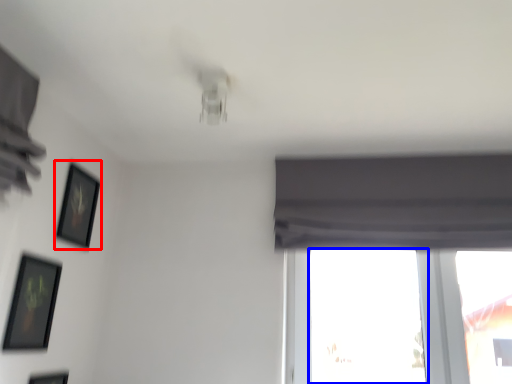
Question: Which point is closer to the camera, picture frame (highlighted by a red box) or window (highlighted by a blue box)?

Choices:
 (A) picture frame
 (B) window

Answer: (A)